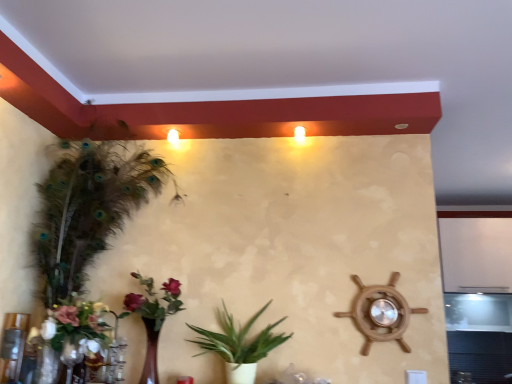
Question: From the image's perspective, is green feathered houseplant at left, arranged as the second houseplant when viewed from the right, above or below matte wooden vase with flowers at lower left, the 2th floral arrangement in the left-to-right sequence?

Choices:
 (A) above
 (B) below

Answer: (A)

Question: From their relative heights in the image, would you say green feathered houseplant at left, which is counted as the 1th houseplant, starting from the left, is taller or shorter than matte wooden vase with flowers at lower left, which ranks as the 1th floral arrangement in right-to-left order?

Choices:
 (A) tall
 (B) short

Answer: (A)

Question: Which of these objects is positioned farthest from the green leafy plant at center, the 1th houseplant viewed from the right?

Choices:
 (A) matte wooden vase with flowers at lower left, which ranks as the 1th floral arrangement in right-to-left order
 (B) green feathered houseplant at left, arranged as the second houseplant when viewed from the right
 (C) white matte floral arrangement at lower left, the first floral arrangement viewed from the left

Answer: (B)

Question: Which object is the closest to the matte wooden vase with flowers at lower left, which ranks as the 1th floral arrangement in right-to-left order?

Choices:
 (A) green leafy plant at center, the 1th houseplant viewed from the right
 (B) green feathered houseplant at left, which is counted as the 1th houseplant, starting from the left
 (C) white matte floral arrangement at lower left, the first floral arrangement viewed from the left

Answer: (C)